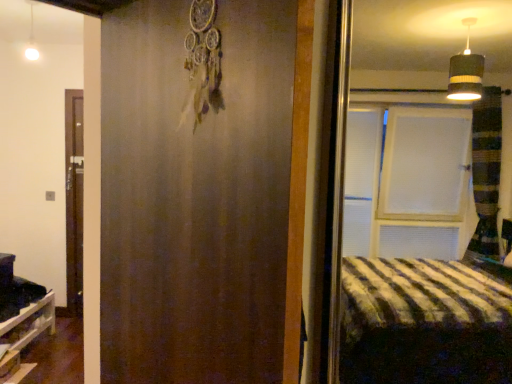
Measure the distance between point (13, 359) and camera.

The depth of point (13, 359) is 2.63 meters.

The image size is (512, 384). Identify the location of matte brown barn door at center. (195, 194).

What do you see at coordinates (195, 194) in the screenshot? I see `matte brown barn door at center` at bounding box center [195, 194].

What do you see at coordinates (31, 38) in the screenshot?
I see `white glossy light fixture at upper left` at bounding box center [31, 38].

In order to face white glossy light fixture at upper left, should I rotate leftwards or rightwards?

Rotate left and turn 27.662 degrees.

Identify the location of white wooden shelf at lower left. This screenshot has height=384, width=512. (24, 337).

Based on the photo, can you confirm if matte brown barn door at center is positioned to the left of white glossy light fixture at upper left?

No.

Consider the image. Between matte brown barn door at center and white glossy light fixture at upper left, which one has smaller width?

white glossy light fixture at upper left is thinner.

This screenshot has height=384, width=512. I want to click on light fixture located above the matte brown barn door at center (from a real-world perspective), so click(31, 38).

What's the angular difference between matte brown barn door at center and white glossy light fixture at upper left's facing directions?

61.8 degrees separate the facing orientations of matte brown barn door at center and white glossy light fixture at upper left.

Which object is closer to the camera taking this photo, white glossy light fixture at upper left or white wooden shelf at lower left?

white glossy light fixture at upper left is closer to the camera.

Is white glossy light fixture at upper left far away from white wooden shelf at lower left?

Yes, white glossy light fixture at upper left is far from white wooden shelf at lower left.

From a real-world perspective, is white glossy light fixture at upper left positioned above or below white wooden shelf at lower left?

Clearly, from a real-world perspective, white glossy light fixture at upper left is above white wooden shelf at lower left.

Is white wooden shelf at lower left oriented away from matte brown barn door at center?

No, white wooden shelf at lower left is not facing away from matte brown barn door at center.

From the image's perspective, which is below, white wooden shelf at lower left or matte brown barn door at center?

white wooden shelf at lower left.

Looking at this image, from a real-world perspective, is white wooden shelf at lower left on top of matte brown barn door at center?

No, from a real-world perspective, white wooden shelf at lower left is not on top of matte brown barn door at center.

Which of these two, white wooden shelf at lower left or white glossy light fixture at upper left, is smaller?

white glossy light fixture at upper left.

In the scene shown: From a real-world perspective, is white wooden shelf at lower left on white glossy light fixture at upper left?

No.

Is white wooden shelf at lower left in contact with white glossy light fixture at upper left?

No, white wooden shelf at lower left is not next to white glossy light fixture at upper left.

How many degrees apart are the facing directions of white glossy light fixture at upper left and matte brown barn door at center?

There is a 61.8-degree angle between the facing directions of white glossy light fixture at upper left and matte brown barn door at center.

Considering the relative sizes of white glossy light fixture at upper left and matte brown barn door at center in the image provided, is white glossy light fixture at upper left smaller than matte brown barn door at center?

Correct, white glossy light fixture at upper left occupies less space than matte brown barn door at center.

Considering the relative sizes of white glossy light fixture at upper left and matte brown barn door at center in the image provided, is white glossy light fixture at upper left wider than matte brown barn door at center?

No, white glossy light fixture at upper left is not wider than matte brown barn door at center.

Which of these two, matte brown barn door at center or white wooden shelf at lower left, is smaller?

With smaller size is white wooden shelf at lower left.

Can white wooden shelf at lower left be found inside matte brown barn door at center?

No.

Looking at this image, is matte brown barn door at center at the right side of white wooden shelf at lower left?

Indeed, matte brown barn door at center is positioned on the right side of white wooden shelf at lower left.

How distant is matte brown barn door at center from white wooden shelf at lower left?

The distance of matte brown barn door at center from white wooden shelf at lower left is 2.31 meters.

Identify the location of barn door below the white glossy light fixture at upper left (from a real-world perspective). (195, 194).

This screenshot has height=384, width=512. What are the coordinates of `shelf below the white glossy light fixture at upper left (from the image's perspective)` in the screenshot? It's located at (24, 337).

Looking at the image, which one is located closer to matte brown barn door at center, white wooden shelf at lower left or white glossy light fixture at upper left?

white wooden shelf at lower left lies closer to matte brown barn door at center than the other object.

Which object lies nearer to the anchor point white glossy light fixture at upper left, matte brown barn door at center or white wooden shelf at lower left?

white wooden shelf at lower left.

Which object lies further to the anchor point white wooden shelf at lower left, matte brown barn door at center or white glossy light fixture at upper left?

Based on the image, matte brown barn door at center appears to be further to white wooden shelf at lower left.

From the image, which object appears to be nearer to matte brown barn door at center, white glossy light fixture at upper left or white wooden shelf at lower left?

Based on the image, white wooden shelf at lower left appears to be nearer to matte brown barn door at center.

Looking at the image, which one is located closer to white glossy light fixture at upper left, white wooden shelf at lower left or matte brown barn door at center?

white wooden shelf at lower left is positioned closer to the anchor white glossy light fixture at upper left.

Looking at the image, which one is located closer to white wooden shelf at lower left, white glossy light fixture at upper left or matte brown barn door at center?

The object closer to white wooden shelf at lower left is white glossy light fixture at upper left.

Image resolution: width=512 pixels, height=384 pixels. What are the coordinates of `light fixture between matte brown barn door at center and white wooden shelf at lower left along the z-axis` in the screenshot? It's located at (31, 38).